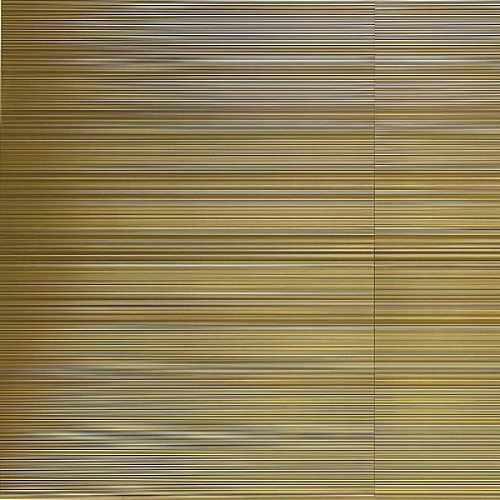
Identify the location of lighting highlights. The width and height of the screenshot is (500, 500). tap(403, 60), tap(296, 60), tap(234, 23).